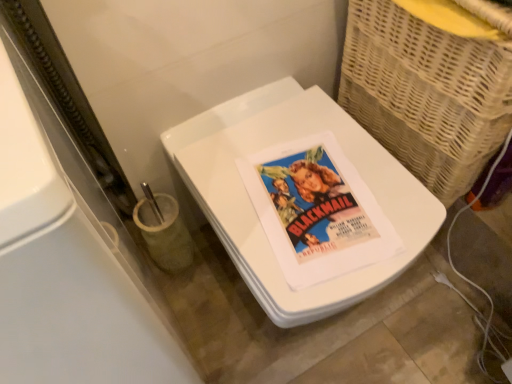
Locate an element on the screen. This screenshot has height=384, width=512. vacant space situated on the left part of matte paper poster at center is located at coordinates (237, 200).